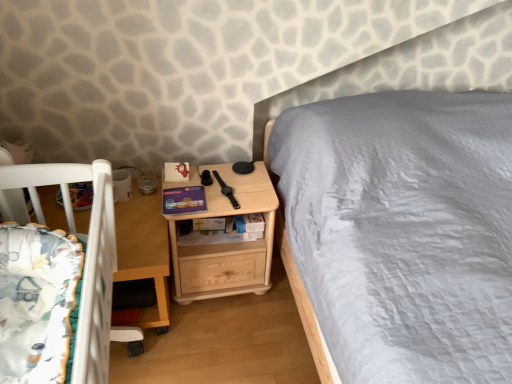
Question: Does light wood/texture nightstand at center have a greater width compared to wooden table at lower left?

Choices:
 (A) yes
 (B) no

Answer: (B)

Question: From a real-world perspective, is light wood/texture nightstand at center positioned over wooden table at lower left based on gravity?

Choices:
 (A) no
 (B) yes

Answer: (B)

Question: From a real-world perspective, is light wood/texture nightstand at center located beneath wooden table at lower left?

Choices:
 (A) no
 (B) yes

Answer: (A)

Question: Does light wood/texture nightstand at center appear on the left side of wooden table at lower left?

Choices:
 (A) yes
 (B) no

Answer: (B)

Question: Is light wood/texture nightstand at center not within wooden table at lower left?

Choices:
 (A) yes
 (B) no

Answer: (A)

Question: Is light wood/texture nightstand at center positioned with its back to wooden table at lower left?

Choices:
 (A) no
 (B) yes

Answer: (A)

Question: Considering the relative sizes of light wood/texture nightstand at center and fluffy white blanket at lower left in the image provided, is light wood/texture nightstand at center smaller than fluffy white blanket at lower left?

Choices:
 (A) yes
 (B) no

Answer: (B)

Question: Is fluffy white blanket at lower left inside light wood/texture nightstand at center?

Choices:
 (A) yes
 (B) no

Answer: (B)

Question: Does light wood/texture nightstand at center turn towards fluffy white blanket at lower left?

Choices:
 (A) yes
 (B) no

Answer: (B)

Question: Is there a large distance between light wood/texture nightstand at center and fluffy white blanket at lower left?

Choices:
 (A) yes
 (B) no

Answer: (B)

Question: From the image's perspective, is light wood/texture nightstand at center located above fluffy white blanket at lower left?

Choices:
 (A) yes
 (B) no

Answer: (A)

Question: Is light wood/texture nightstand at center taller than fluffy white blanket at lower left?

Choices:
 (A) yes
 (B) no

Answer: (A)

Question: From a real-world perspective, does fluffy white blanket at lower left sit lower than light wood/texture nightstand at center?

Choices:
 (A) yes
 (B) no

Answer: (B)